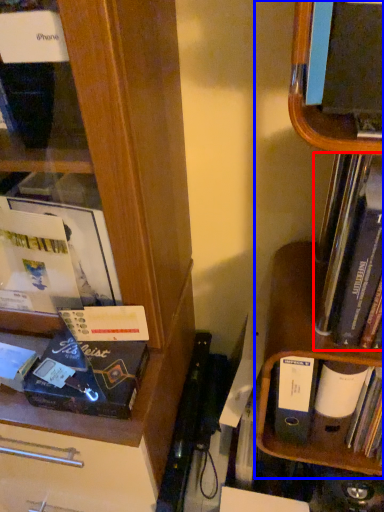
Question: Which object appears closest to the camera in this image, book (highlighted by a red box) or shelf (highlighted by a blue box)?

Choices:
 (A) book
 (B) shelf

Answer: (B)